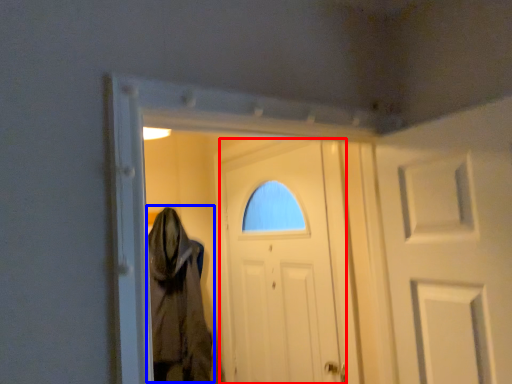
Question: Among these objects, which one is nearest to the camera, door (highlighted by a red box) or cloak (highlighted by a blue box)?

Choices:
 (A) door
 (B) cloak

Answer: (A)